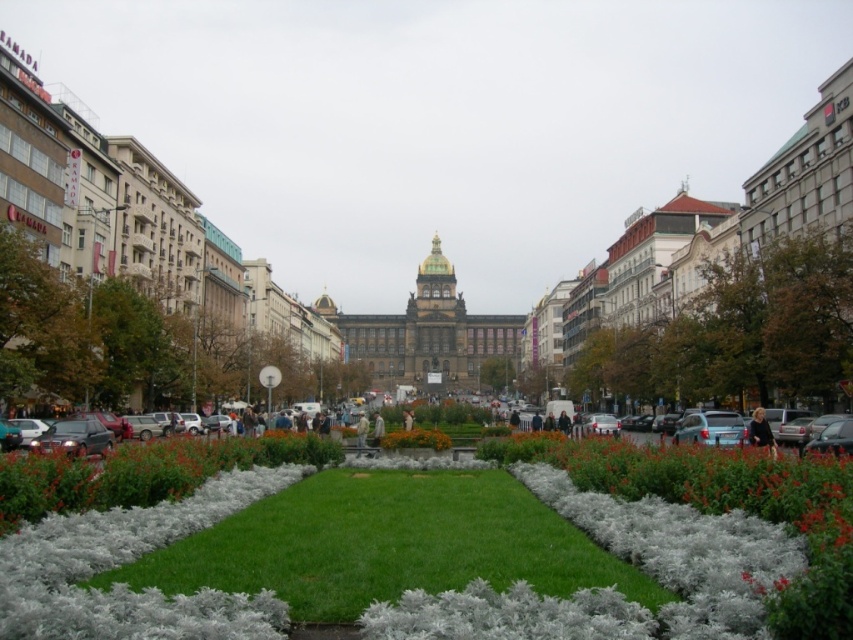
How far apart are green grass at center and orange matte flower bed at center?

green grass at center and orange matte flower bed at center are 26.59 meters apart from each other.

Is green grass at center bigger than orange matte flower bed at center?

Indeed, green grass at center has a larger size compared to orange matte flower bed at center.

Which is in front, point (135, 630) or point (440, 449)?

Positioned in front is point (135, 630).

What are the coordinates of `green grass at center` in the screenshot? It's located at (706, 561).

This screenshot has width=853, height=640. Identify the location of green soft grass at center. (386, 544).

Does point (456, 476) come closer to viewer compared to point (401, 436)?

Yes.

Which is behind, point (201, 547) or point (440, 444)?

The point (440, 444) is behind.

Image resolution: width=853 pixels, height=640 pixels. Identify the location of green soft grass at center. (386, 544).

Who is higher up, green grass at center or green soft grass at center?

Positioned higher is green grass at center.

Can you confirm if green grass at center is positioned above green soft grass at center?

Correct, green grass at center is located above green soft grass at center.

Which is in front, point (796, 593) or point (387, 481)?

Positioned in front is point (796, 593).

The height and width of the screenshot is (640, 853). I want to click on green grass at center, so click(706, 561).